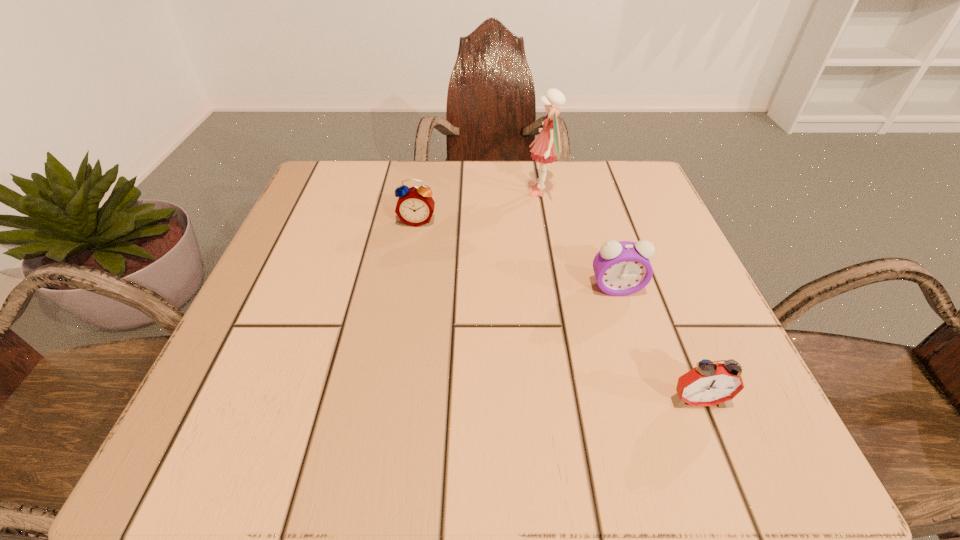
Locate an element on the screen. Image resolution: width=960 pixels, height=540 pixels. unoccupied position between the third farthest object and the nearest alarm clock is located at coordinates (657, 344).

Identify the location of empty space that is in between the doll and the nearest object. pos(619,296).

Locate an element on the screen. The height and width of the screenshot is (540, 960). free spot between the third farthest object and the second farthest object is located at coordinates (516, 254).

Identify which object is located as the nearest to the second nearest alarm clock. Please provide its 2D coordinates. Your answer should be formatted as a tuple, i.e. [(x, y)], where the tuple contains the x and y coordinates of a point satisfying the conditions above.

[(708, 384)]

The width and height of the screenshot is (960, 540). In order to click on object that is the closest to the second nearest object in this screenshot , I will do `click(708, 384)`.

Select which alarm clock appears as the closest to the farthest alarm clock. Please provide its 2D coordinates. Your answer should be formatted as a tuple, i.e. [(x, y)], where the tuple contains the x and y coordinates of a point satisfying the conditions above.

[(622, 268)]

You are a GUI agent. You are given a task and a screenshot of the screen. Output one action in this format:
    pyautogui.click(x=<x>, y=<y>)
    Task: Click on the alarm clock that is the second closest to the tallest object
    The width and height of the screenshot is (960, 540).
    Given the screenshot: What is the action you would take?
    [622, 268]